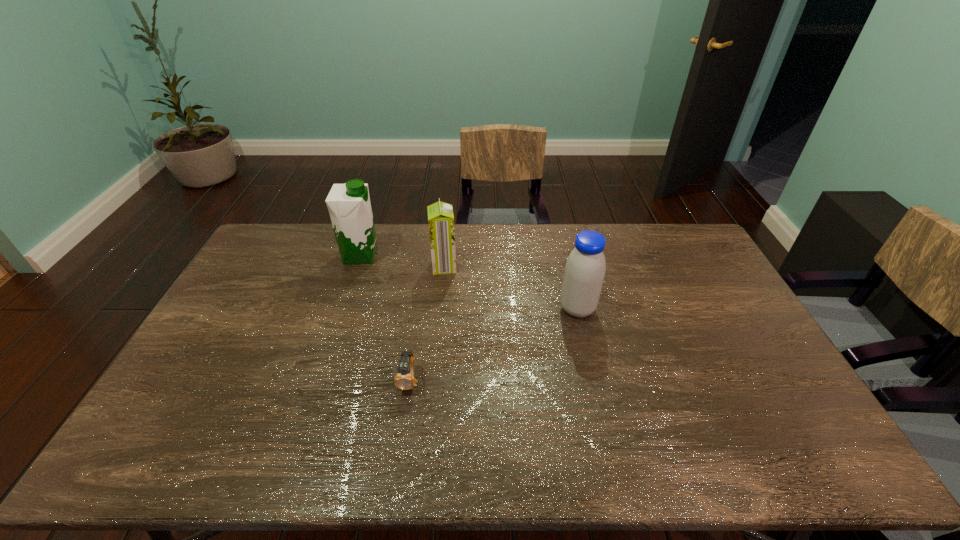
Image resolution: width=960 pixels, height=540 pixels. In order to click on vacant region that satisfies the following two spatial constraints: 1. on the front-facing side of the second soya milk from right to left; 2. on the left side of the leftmost soya milk in this screenshot , I will do `click(357, 266)`.

Locate an element on the screen. free spot that satisfies the following two spatial constraints: 1. on the back side of the second nearest object; 2. on the front-facing side of the leftmost soya milk is located at coordinates (565, 255).

The width and height of the screenshot is (960, 540). In order to click on free space that satisfies the following two spatial constraints: 1. on the front-facing side of the rightmost object; 2. on the right side of the leftmost soya milk in this screenshot , I will do `click(343, 309)`.

This screenshot has width=960, height=540. Find the location of `free space that satisfies the following two spatial constraints: 1. on the back side of the second soya milk from right to left; 2. on the front-facing side of the leftmost soya milk`. free space that satisfies the following two spatial constraints: 1. on the back side of the second soya milk from right to left; 2. on the front-facing side of the leftmost soya milk is located at coordinates (445, 255).